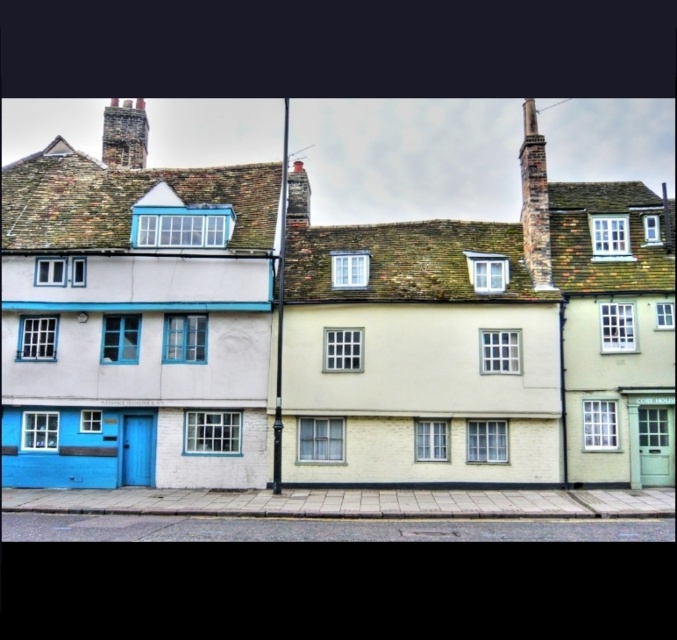
Who is lower down, rustic stone chimney at upper left or smooth brick chimney at center?

smooth brick chimney at center is lower down.

Is point (137, 99) positioned behind point (297, 188)?

That is True.

At what (x,y) coordinates should I click in order to perform the action: click on rustic stone chimney at upper left. Please return your answer as a coordinate pair (x, y). Looking at the image, I should click on (125, 134).

Does point (527, 173) come closer to viewer compared to point (137, 99)?

Yes.

Who is more forward, (519,160) or (144,154)?

Point (144,154) is more forward.

Is point (529, 248) closer to viewer compared to point (127, 132)?

That is True.

I want to click on rustic brick chimney at upper right, so click(x=533, y=200).

Is rustic brick chimney at upper right further to camera compared to smooth brick chimney at center?

No.

Is rustic brick chimney at upper right to the left of smooth brick chimney at center from the viewer's perspective?

No, rustic brick chimney at upper right is not to the left of smooth brick chimney at center.

Describe the element at coordinates (533, 200) in the screenshot. I see `rustic brick chimney at upper right` at that location.

This screenshot has height=640, width=677. I want to click on rustic brick chimney at upper right, so click(x=533, y=200).